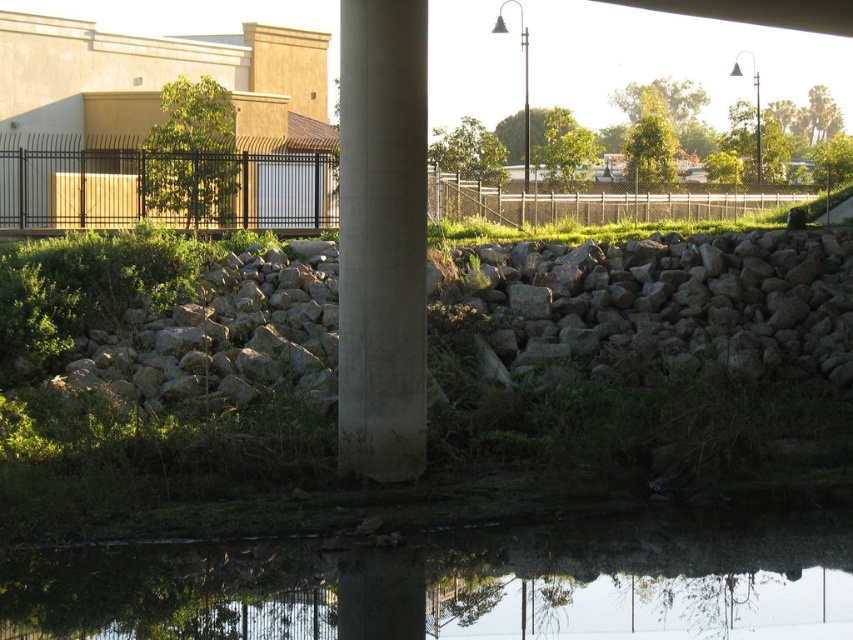
You are a construction worker needing to place a new support beam that must be placed above the gray rough stone at center. Is the smooth concrete pillar at center already in a suitable position to support the beam?

The gray rough stone at center is positioned under the smooth concrete pillar at center, so the smooth concrete pillar at center is already above the gray rough stone at center. Therefore, the smooth concrete pillar at center is in a suitable position to support the beam above the gray rough stone at center.

You are a photographer trying to capture the gray rough stone at center and the transparent glass water at center bottom in a single shot. Based on their heights, which object will appear larger in the photo?

The gray rough stone at center will appear larger in the photo since it has a greater height than the transparent glass water at center bottom.